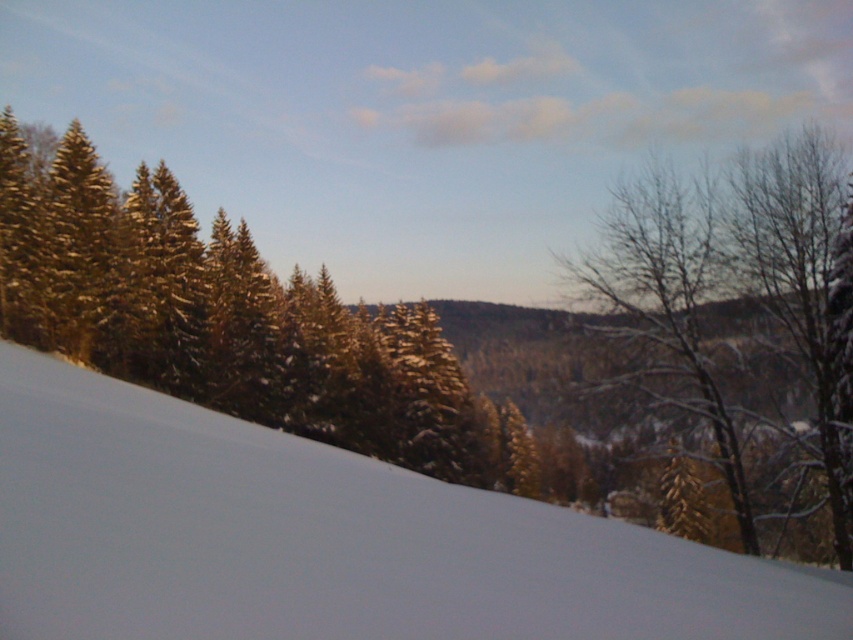
Between point (538, 525) and point (730, 264), which one is positioned behind?

The point (730, 264) is behind.

Is white powdery snow at lower left further to the viewer compared to snow-covered bare tree at right?

No, white powdery snow at lower left is closer to the viewer.

Between point (590, 518) and point (782, 193), which one is positioned in front?

Point (590, 518) is more forward.

Find the location of `white powdery snow at lower left`. white powdery snow at lower left is located at coordinates (326, 540).